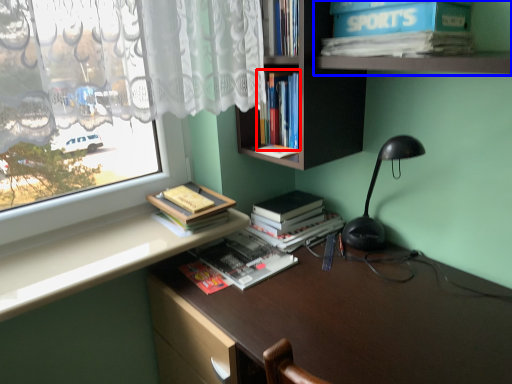
Question: Which object appears farthest to the camera in this image, book (highlighted by a red box) or shelf (highlighted by a blue box)?

Choices:
 (A) book
 (B) shelf

Answer: (A)